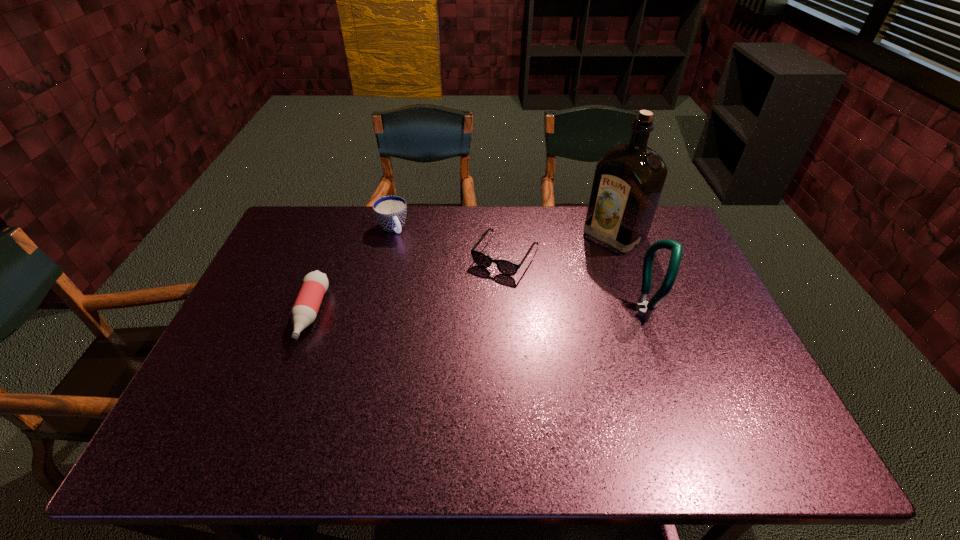
Identify the location of free space located on the side of the cup with the handle. (416, 270).

Locate an element on the screen. The image size is (960, 540). vacant area situated 0.190m on the side of the cup with the handle is located at coordinates (418, 274).

You are a GUI agent. You are given a task and a screenshot of the screen. Output one action in this format:
    pyautogui.click(x=<x>, y=<y>)
    Task: Click on the free space located on the side of the cup with the handle
    
    Given the screenshot: What is the action you would take?
    pyautogui.click(x=431, y=295)

Locate an element on the screen. vacant space located on the label of the liquor is located at coordinates (560, 277).

Where is `free region located on the label of the liquor`? This screenshot has height=540, width=960. free region located on the label of the liquor is located at coordinates (549, 285).

The image size is (960, 540). What are the coordinates of `free space located 0.150m on the label of the liquor` in the screenshot? It's located at (568, 271).

Where is `vacant space positioned at the front lenses of the shortest object`? This screenshot has height=540, width=960. vacant space positioned at the front lenses of the shortest object is located at coordinates (465, 314).

Where is `free point located at the front lenses of the shortest object`? This screenshot has width=960, height=540. free point located at the front lenses of the shortest object is located at coordinates click(443, 345).

Identify the location of free space located at the front lenses of the shortest object. This screenshot has height=540, width=960. (458, 323).

Identify the location of cup located at the far edge. (390, 211).